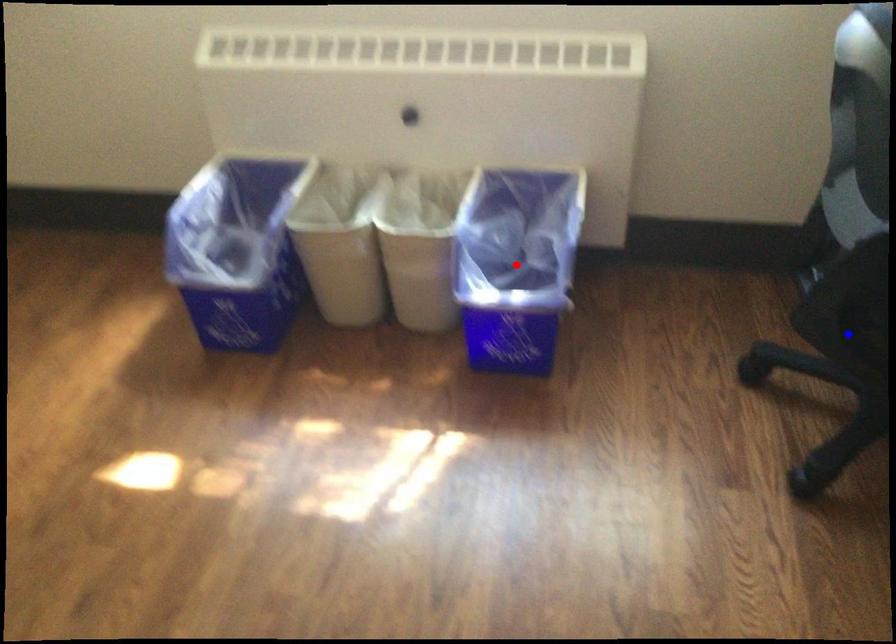
Question: Which of the two points in the image is closer to the camera?

Choices:
 (A) Blue point is closer.
 (B) Red point is closer.

Answer: (A)